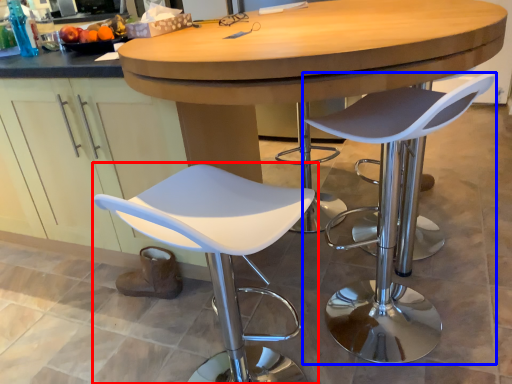
Question: Which object appears farthest to the camera in this image, chair (highlighted by a red box) or chair (highlighted by a blue box)?

Choices:
 (A) chair
 (B) chair

Answer: (B)